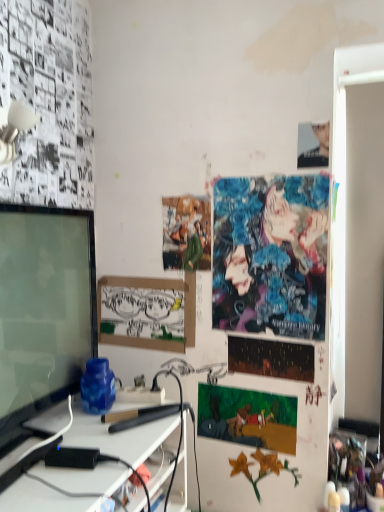
Image resolution: width=384 pixels, height=512 pixels. What do you see at coordinates (147, 312) in the screenshot? I see `white paper at center` at bounding box center [147, 312].

This screenshot has height=512, width=384. Describe the element at coordinates (313, 145) in the screenshot. I see `smooth black shirt at upper right` at that location.

What do you see at coordinates (248, 417) in the screenshot? This screenshot has width=384, height=512. I see `cartoon paper at center, the 4th poster page when ordered from top to bottom` at bounding box center [248, 417].

Measure the distance between matte green fabric poster at center, acting as the fourth poster page starting from the bottom, and camera.

matte green fabric poster at center, acting as the fourth poster page starting from the bottom, is 5.13 feet away from camera.

Find the location of a particular element. This screenshot has height=512, width=384. vibrant digital art at upper right, the third poster page positioned from the bottom is located at coordinates (270, 255).

This screenshot has width=384, height=512. What do you see at coordinates (270, 255) in the screenshot?
I see `vibrant digital art at upper right, the third poster page positioned from the bottom` at bounding box center [270, 255].

Measure the distance between dark matte poster at center, placed as the second poster page when sorted from bottom to top, and camera.

1.47 meters.

The width and height of the screenshot is (384, 512). Find the location of `white paper at center`. white paper at center is located at coordinates (147, 312).

Is matte black monitor at left facing away from dark matte poster at center, which is the 3th poster page in top-to-bottom order?

No, matte black monitor at left's orientation is not away from dark matte poster at center, which is the 3th poster page in top-to-bottom order.

Is matte black monitor at left positioned beyond the bounds of dark matte poster at center, placed as the second poster page when sorted from bottom to top?

Absolutely, matte black monitor at left is external to dark matte poster at center, placed as the second poster page when sorted from bottom to top.

Where is `television above the dark matte poster at center, which is the 3th poster page in top-to-bottom order (from the image's perspective)`? This screenshot has height=512, width=384. television above the dark matte poster at center, which is the 3th poster page in top-to-bottom order (from the image's perspective) is located at coordinates (44, 308).

Which is in front, matte black monitor at left or dark matte poster at center, which is the 3th poster page in top-to-bottom order?

Positioned in front is matte black monitor at left.

Who is bigger, vibrant digital art at upper right, the third poster page positioned from the bottom, or matte green fabric poster at center, acting as the fourth poster page starting from the bottom?

Bigger between the two is vibrant digital art at upper right, the third poster page positioned from the bottom.

Which is more to the left, vibrant digital art at upper right, the 2th poster page in the top-to-bottom sequence, or matte green fabric poster at center, the 1th poster page viewed from the top?

matte green fabric poster at center, the 1th poster page viewed from the top, is more to the left.

Is vibrant digital art at upper right, the 2th poster page in the top-to-bottom sequence, facing towards matte green fabric poster at center, acting as the fourth poster page starting from the bottom?

No, vibrant digital art at upper right, the 2th poster page in the top-to-bottom sequence, is not aimed at matte green fabric poster at center, acting as the fourth poster page starting from the bottom.

Is point (323, 236) positioned after point (205, 256)?

No, it is in front of (205, 256).

Considering the points (326, 147) and (118, 291), which point is behind, point (326, 147) or point (118, 291)?

The point (118, 291) is farther.

Between smooth black shirt at upper right and white paper at center, which one appears on the right side from the viewer's perspective?

Answer: Positioned to the right is smooth black shirt at upper right.

From a real-world perspective, is smooth black shirt at upper right on top of white paper at center?

Yes, from a real-world perspective, smooth black shirt at upper right is over white paper at center

Are smooth black shirt at upper right and white paper at center beside each other?

No, smooth black shirt at upper right is not making contact with white paper at center.

Is cartoon paper at center, the 4th poster page when ordered from top to bottom, surrounding vibrant digital art at upper right, the third poster page positioned from the bottom?

That's incorrect, vibrant digital art at upper right, the third poster page positioned from the bottom, is not inside cartoon paper at center, the 4th poster page when ordered from top to bottom.

Identify the location of the 2nd poster page above the cartoon paper at center, arranged as the 1th poster page when ordered from the bottom (from the image's perspective). This screenshot has width=384, height=512. 270,255.

From a real-world perspective, is cartoon paper at center, the 4th poster page when ordered from top to bottom, over vibrant digital art at upper right, the third poster page positioned from the bottom?

Actually, cartoon paper at center, the 4th poster page when ordered from top to bottom, is physically below vibrant digital art at upper right, the third poster page positioned from the bottom, in the real world.

From the image's perspective, which one is positioned lower, cartoon paper at center, the 4th poster page when ordered from top to bottom, or vibrant digital art at upper right, the 2th poster page in the top-to-bottom sequence?

cartoon paper at center, the 4th poster page when ordered from top to bottom, appears lower in the image.

From the image's perspective, is white paper at center below smooth black shirt at upper right?

Indeed, from the image's perspective, white paper at center is shown beneath smooth black shirt at upper right.

Considering the sizes of white paper at center and smooth black shirt at upper right in the image, is white paper at center bigger or smaller than smooth black shirt at upper right?

Clearly, white paper at center is larger in size than smooth black shirt at upper right.

Between point (166, 345) and point (302, 157), which one is positioned behind?

The point (166, 345) is more distant.

Does white paper at center appear on the right side of smooth black shirt at upper right?

In fact, white paper at center is to the left of smooth black shirt at upper right.

From a real-world perspective, is matte black monitor at left located higher than matte green fabric poster at center, acting as the fourth poster page starting from the bottom?

No, from a real-world perspective, matte black monitor at left is not on top of matte green fabric poster at center, acting as the fourth poster page starting from the bottom.

From the image's perspective, which one is positioned higher, matte black monitor at left or matte green fabric poster at center, the 1th poster page viewed from the top?

matte green fabric poster at center, the 1th poster page viewed from the top, from the image's perspective.

Is matte black monitor at left facing towards matte green fabric poster at center, acting as the fourth poster page starting from the bottom?

No, matte black monitor at left does not turn towards matte green fabric poster at center, acting as the fourth poster page starting from the bottom.

Based on the photo, which object is thinner, matte black monitor at left or matte green fabric poster at center, acting as the fourth poster page starting from the bottom?

matte green fabric poster at center, acting as the fourth poster page starting from the bottom, is thinner.

Identify the location of the 1st poster page counting from the right of the cartoon paper at center, arranged as the 1th poster page when ordered from the bottom. Image resolution: width=384 pixels, height=512 pixels. (270, 255).

Which is behind, point (302, 263) or point (250, 445)?

Positioned behind is point (250, 445).

Is cartoon paper at center, the 4th poster page when ordered from top to bottom, at the back of vibrant digital art at upper right, the 2th poster page in the top-to-bottom sequence?

No, vibrant digital art at upper right, the 2th poster page in the top-to-bottom sequence,'s orientation is not away from cartoon paper at center, the 4th poster page when ordered from top to bottom.

Which object is wider, vibrant digital art at upper right, the 2th poster page in the top-to-bottom sequence, or cartoon paper at center, arranged as the 1th poster page when ordered from the bottom?

Wider between the two is vibrant digital art at upper right, the 2th poster page in the top-to-bottom sequence.

Where is `television above the dark matte poster at center, which is the 3th poster page in top-to-bottom order (from the image's perspective)`? television above the dark matte poster at center, which is the 3th poster page in top-to-bottom order (from the image's perspective) is located at coordinates (44, 308).

From the vibrant digital art at upper right, the third poster page positioned from the bottom, count the 2nd poster page to the left and point to it. Please provide its 2D coordinates.

[(186, 233)]

Estimate the real-world distances between objects in this image. Which object is closer to white paper at center, smooth black shirt at upper right or vibrant digital art at upper right, the 2th poster page in the top-to-bottom sequence?

The object closer to white paper at center is vibrant digital art at upper right, the 2th poster page in the top-to-bottom sequence.

From the image, which object appears to be farther from matte green fabric poster at center, the 1th poster page viewed from the top, dark matte poster at center, which is the 3th poster page in top-to-bottom order, or matte black monitor at left?

matte black monitor at left is positioned further to the anchor matte green fabric poster at center, the 1th poster page viewed from the top.

Based on their spatial positions, is smooth black shirt at upper right or cartoon paper at center, arranged as the 1th poster page when ordered from the bottom, closer to matte green fabric poster at center, acting as the fourth poster page starting from the bottom?

smooth black shirt at upper right.

Based on the photo, from the image, which object appears to be farther from matte black monitor at left, dark matte poster at center, placed as the second poster page when sorted from bottom to top, or white paper at center?

dark matte poster at center, placed as the second poster page when sorted from bottom to top, is further to matte black monitor at left.

Looking at the image, which one is located closer to matte green fabric poster at center, acting as the fourth poster page starting from the bottom, dark matte poster at center, placed as the second poster page when sorted from bottom to top, or white paper at center?

Among the two, white paper at center is located nearer to matte green fabric poster at center, acting as the fourth poster page starting from the bottom.

Which object lies nearer to the anchor point cartoon paper at center, the 4th poster page when ordered from top to bottom, smooth black shirt at upper right or matte black monitor at left?

matte black monitor at left.

Estimate the real-world distances between objects in this image. Which object is closer to white paper at center, dark matte poster at center, placed as the second poster page when sorted from bottom to top, or smooth black shirt at upper right?

The object closer to white paper at center is dark matte poster at center, placed as the second poster page when sorted from bottom to top.

Considering their positions, is white paper at center positioned further to vibrant digital art at upper right, the 2th poster page in the top-to-bottom sequence, than cartoon paper at center, the 4th poster page when ordered from top to bottom?

The object further to vibrant digital art at upper right, the 2th poster page in the top-to-bottom sequence, is cartoon paper at center, the 4th poster page when ordered from top to bottom.

Locate an element on the screen. poster page between matte green fabric poster at center, acting as the fourth poster page starting from the bottom, and dark matte poster at center, placed as the second poster page when sorted from bottom to top, from top to bottom is located at coordinates (270, 255).

Where is `picture frame that lies between smooth black shirt at upper right and cartoon paper at center, arranged as the 1th poster page when ordered from the bottom, from top to bottom`? The width and height of the screenshot is (384, 512). picture frame that lies between smooth black shirt at upper right and cartoon paper at center, arranged as the 1th poster page when ordered from the bottom, from top to bottom is located at coordinates (147, 312).

The width and height of the screenshot is (384, 512). What are the coordinates of `poster page between vibrant digital art at upper right, the third poster page positioned from the bottom, and cartoon paper at center, the 4th poster page when ordered from top to bottom, in the up-down direction` in the screenshot? It's located at (271, 358).

At what (x,y) coordinates should I click in order to perform the action: click on picture frame between matte black monitor at left and smooth black shirt at upper right. Please return your answer as a coordinate pair (x, y). This screenshot has width=384, height=512. Looking at the image, I should click on (147, 312).